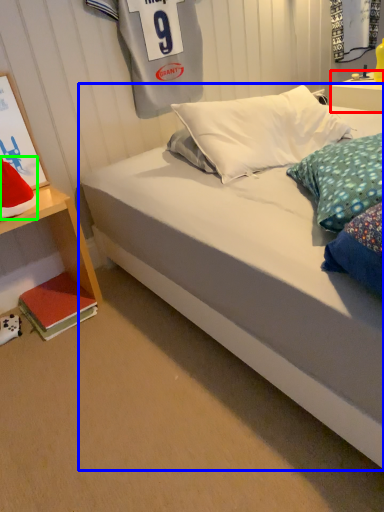
Question: Based on their relative distances, which object is nearer to nightstand (highlighted by a red box)? Choose from bed (highlighted by a blue box) and pillow (highlighted by a green box).

Choices:
 (A) bed
 (B) pillow

Answer: (A)